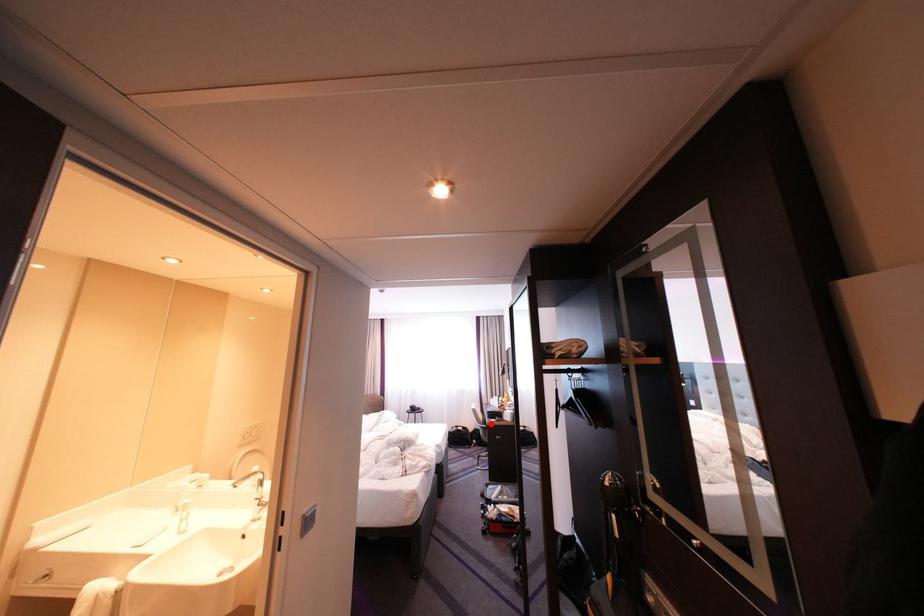
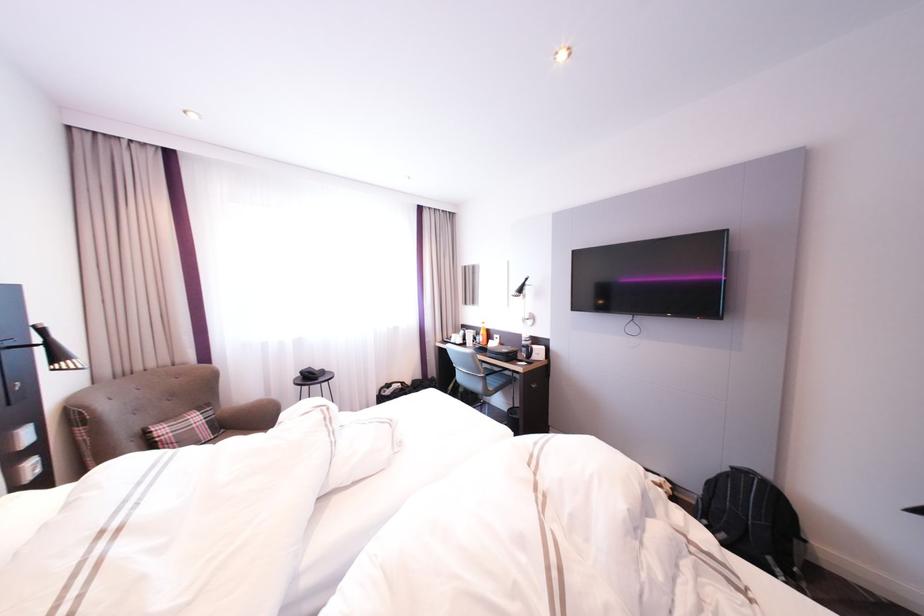
In the second image, find the point that corresponds to the highlighted location in the first image.

(492, 373)